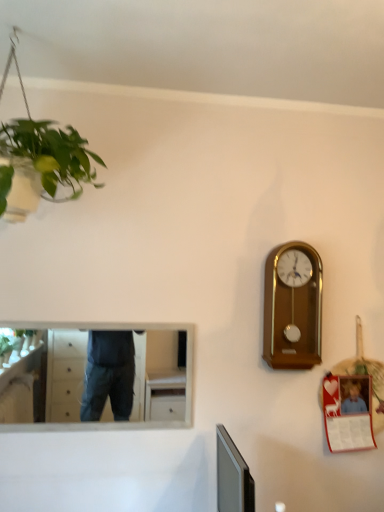
Question: Is wooden wall clock at right shorter than white glossy mirror at upper left?

Choices:
 (A) no
 (B) yes

Answer: (A)

Question: Is wooden wall clock at right looking in the opposite direction of white glossy mirror at upper left?

Choices:
 (A) no
 (B) yes

Answer: (A)

Question: Could white glossy mirror at upper left be considered to be inside wooden wall clock at right?

Choices:
 (A) no
 (B) yes

Answer: (A)

Question: Does wooden wall clock at right appear on the right side of white glossy mirror at upper left?

Choices:
 (A) yes
 (B) no

Answer: (A)

Question: Considering the relative sizes of wooden wall clock at right and white glossy mirror at upper left in the image provided, is wooden wall clock at right wider than white glossy mirror at upper left?

Choices:
 (A) no
 (B) yes

Answer: (B)

Question: Does wooden wall clock at right lie behind white glossy mirror at upper left?

Choices:
 (A) no
 (B) yes

Answer: (B)

Question: Is white glossy mirror at upper left taller than wooden wall clock at right?

Choices:
 (A) no
 (B) yes

Answer: (A)

Question: Considering the relative sizes of white glossy mirror at upper left and wooden wall clock at right in the image provided, is white glossy mirror at upper left shorter than wooden wall clock at right?

Choices:
 (A) no
 (B) yes

Answer: (B)

Question: Can you confirm if white glossy mirror at upper left is positioned to the left of wooden wall clock at right?

Choices:
 (A) yes
 (B) no

Answer: (A)

Question: Is white glossy mirror at upper left closer to camera compared to wooden wall clock at right?

Choices:
 (A) yes
 (B) no

Answer: (A)

Question: Can you confirm if white glossy mirror at upper left is thinner than wooden wall clock at right?

Choices:
 (A) no
 (B) yes

Answer: (B)

Question: From the image's perspective, is white glossy mirror at upper left below wooden wall clock at right?

Choices:
 (A) yes
 (B) no

Answer: (A)

Question: Considering their positions, is white glossy mirror at upper left located in front of or behind wooden wall clock at right?

Choices:
 (A) behind
 (B) front

Answer: (B)